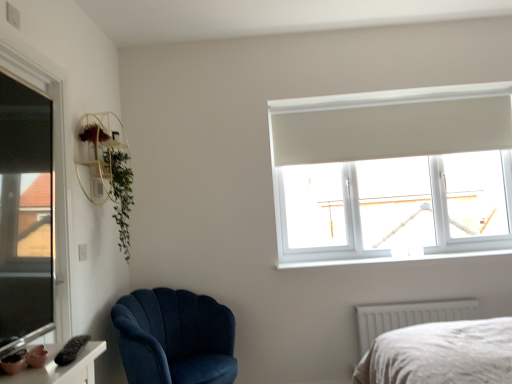
Question: From the image's perspective, is green leafy plant at upper left positioned above or below white plastic window sill at upper right?

Choices:
 (A) above
 (B) below

Answer: (A)

Question: Is green leafy plant at upper left inside or outside of white plastic window sill at upper right?

Choices:
 (A) outside
 (B) inside

Answer: (A)

Question: Estimate the real-world distances between objects in this image. Which object is farther from the white textured radiator at lower right?

Choices:
 (A) transparent glass window at left, which is the second window in back-to-front order
 (B) transparent glass window at upper right, which is the 1th window in back-to-front order
 (C) white plastic window sill at upper right
 (D) matte pink ceramic at lower left
 (E) velvet blue armchair at lower left

Answer: (D)

Question: Estimate the real-world distances between objects in this image. Which object is closer to the white plastic window sill at upper right?

Choices:
 (A) gold metallic shelf at upper left
 (B) green leafy plant at upper left
 (C) transparent glass window at upper right, marked as the 2th window in a front-to-back arrangement
 (D) white textured radiator at lower right
 (E) transparent glass window at left, which is the second window in back-to-front order

Answer: (D)